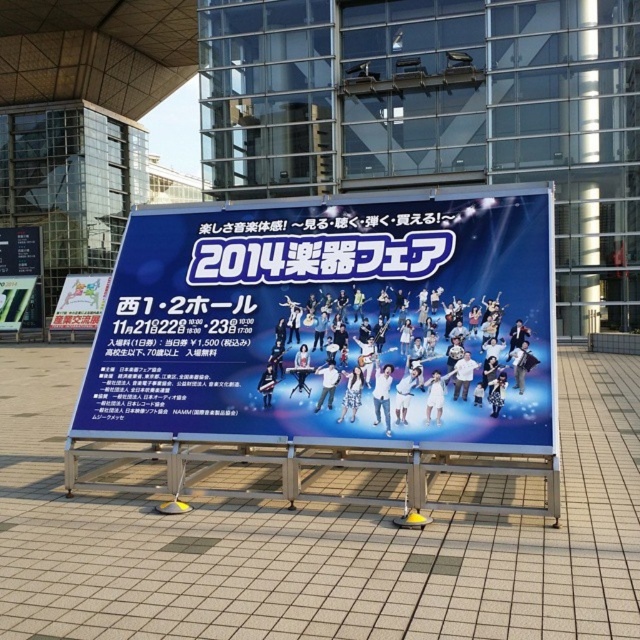
You are a passerby who wants to read the event details on the blue fabric billboard at center and the white paper at lower left. Which one is taller?

The blue fabric billboard at center is taller than the white paper at lower left.

You are standing in front of the modern glass building and want to read the event details on the blue fabric billboard at center and the metallic silver sign at lower left. Which object is positioned lower in the image?

The blue fabric billboard at center is located below the metallic silver sign at lower left, so it is positioned lower in the image.